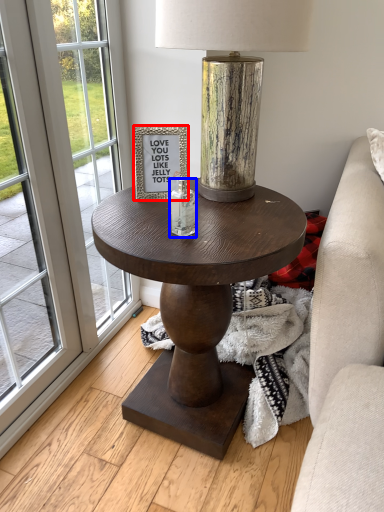
Question: Which point is closer to the camera, picture frame (highlighted by a red box) or candle holder (highlighted by a blue box)?

Choices:
 (A) picture frame
 (B) candle holder

Answer: (B)